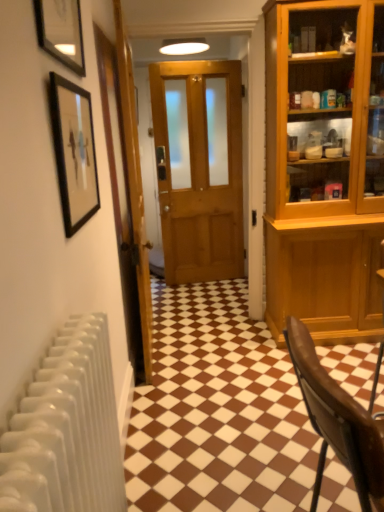
Question: Considering the positions of brown glossy tile at center and matte black picture frame at upper left, which is counted as the 1th picture frame, starting from the top, in the image, is brown glossy tile at center wider or thinner than matte black picture frame at upper left, which is counted as the 1th picture frame, starting from the top,?

Choices:
 (A) thin
 (B) wide

Answer: (B)

Question: Relative to matte black picture frame at upper left, which is counted as the 1th picture frame, starting from the top, is brown glossy tile at center in front or behind?

Choices:
 (A) front
 (B) behind

Answer: (B)

Question: Which object is the farthest from the brown leather chair at lower right?

Choices:
 (A) wooden door at center, the first door when ordered from left to right
 (B) brown glossy tile at center
 (C) black framed picture at upper left, marked as the 2th picture frame in a top-to-bottom arrangement
 (D) wooden door at center, the second door positioned from the left
 (E) matte black picture frame at upper left, which is counted as the 1th picture frame, starting from the top

Answer: (D)

Question: Which of these objects is positioned closest to the wooden door at center, which is the first door from right to left?

Choices:
 (A) brown leather chair at lower right
 (B) wooden door at center, the first door when ordered from left to right
 (C) brown glossy tile at center
 (D) matte black picture frame at upper left, placed as the 2th picture frame when sorted from bottom to top
 (E) black framed picture at upper left, marked as the 2th picture frame in a top-to-bottom arrangement

Answer: (B)